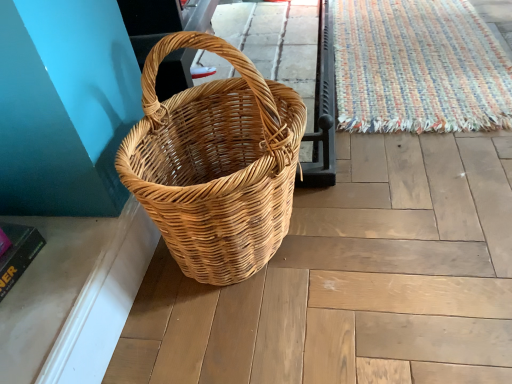
Identify the location of woven wood basket at left. (215, 164).

The height and width of the screenshot is (384, 512). Describe the element at coordinates (215, 164) in the screenshot. I see `woven wood basket at left` at that location.

Identify the location of woven multicolored mat at upper right. pyautogui.click(x=418, y=68).

What do you see at coordinates (418, 68) in the screenshot? The width and height of the screenshot is (512, 384). I see `woven multicolored mat at upper right` at bounding box center [418, 68].

The height and width of the screenshot is (384, 512). In order to click on woven wood basket at left in this screenshot , I will do `click(215, 164)`.

Based on the photo, between woven multicolored mat at upper right and woven wood basket at left, which one appears on the right side from the viewer's perspective?

Positioned to the right is woven multicolored mat at upper right.

Is woven multicolored mat at upper right further to camera compared to woven wood basket at left?

Yes, woven multicolored mat at upper right is behind woven wood basket at left.

Is point (405, 125) closer or farther from the camera than point (242, 91)?

Point (405, 125) appears to be farther away from the viewer than point (242, 91).

From the image's perspective, which is above, woven multicolored mat at upper right or woven wood basket at left?

woven multicolored mat at upper right, from the image's perspective.

From a real-world perspective, is woven multicolored mat at upper right positioned under woven wood basket at left based on gravity?

Correct, in the physical world, woven multicolored mat at upper right is lower than woven wood basket at left.

Considering the relative sizes of woven multicolored mat at upper right and woven wood basket at left in the image provided, is woven multicolored mat at upper right thinner than woven wood basket at left?

Incorrect, the width of woven multicolored mat at upper right is not less than that of woven wood basket at left.

Does woven multicolored mat at upper right have a greater height compared to woven wood basket at left?

No, woven multicolored mat at upper right is not taller than woven wood basket at left.

Can you confirm if woven multicolored mat at upper right is bigger than woven wood basket at left?

Actually, woven multicolored mat at upper right might be smaller than woven wood basket at left.

Is woven multicolored mat at upper right located outside woven wood basket at left?

Yes.

Is woven multicolored mat at upper right far away from woven wood basket at left?

woven multicolored mat at upper right is actually quite close to woven wood basket at left.

Could you tell me if woven multicolored mat at upper right is turned towards woven wood basket at left?

No, woven multicolored mat at upper right does not turn towards woven wood basket at left.

How many degrees apart are the facing directions of woven multicolored mat at upper right and woven wood basket at left?

0.000941 degrees separate the facing orientations of woven multicolored mat at upper right and woven wood basket at left.

How distant is woven multicolored mat at upper right from woven wood basket at left?

woven multicolored mat at upper right and woven wood basket at left are 29.13 inches apart.

The image size is (512, 384). I want to click on picnic basket in front of the woven multicolored mat at upper right, so click(215, 164).

Between woven wood basket at left and woven multicolored mat at upper right, which one appears on the left side from the viewer's perspective?

woven wood basket at left is more to the left.

Which object is more forward, woven wood basket at left or woven multicolored mat at upper right?

woven wood basket at left is closer to the camera.

Which is nearer, (x=267, y=131) or (x=409, y=32)?

The point (x=267, y=131) is more forward.

From the image's perspective, who appears lower, woven wood basket at left or woven multicolored mat at upper right?

woven wood basket at left.

From a real-world perspective, relative to woven multicolored mat at upper right, is woven wood basket at left vertically above or below?

woven wood basket at left is situated higher than woven multicolored mat at upper right in the real world.

Which of these two, woven wood basket at left or woven multicolored mat at upper right, is thinner?

With smaller width is woven wood basket at left.

Which of these two, woven wood basket at left or woven multicolored mat at upper right, stands taller?

woven wood basket at left.

Considering the relative sizes of woven wood basket at left and woven multicolored mat at upper right in the image provided, is woven wood basket at left smaller than woven multicolored mat at upper right?

No.

Could woven multicolored mat at upper right be considered to be inside woven wood basket at left?

No, woven multicolored mat at upper right is not inside woven wood basket at left.

Based on the photo, is woven wood basket at left placed right next to woven multicolored mat at upper right?

woven wood basket at left and woven multicolored mat at upper right are not in contact.

Is woven wood basket at left facing away from woven multicolored mat at upper right?

No, woven wood basket at left is not facing the opposite direction of woven multicolored mat at upper right.

From the picture: What's the angular difference between woven wood basket at left and woven multicolored mat at upper right's facing directions?

The angular difference between woven wood basket at left and woven multicolored mat at upper right is 0.000941 degrees.

Measure the distance from woven wood basket at left to woven multicolored mat at upper right.

woven wood basket at left and woven multicolored mat at upper right are 29.13 inches apart from each other.

Where is `doormat below the woven wood basket at left (from a real-world perspective)`? This screenshot has width=512, height=384. doormat below the woven wood basket at left (from a real-world perspective) is located at coordinates (418, 68).

Find the location of `picnic basket above the woven multicolored mat at upper right (from a real-world perspective)`. picnic basket above the woven multicolored mat at upper right (from a real-world perspective) is located at coordinates (215, 164).

Locate an element on the screen. doormat behind the woven wood basket at left is located at coordinates (418, 68).